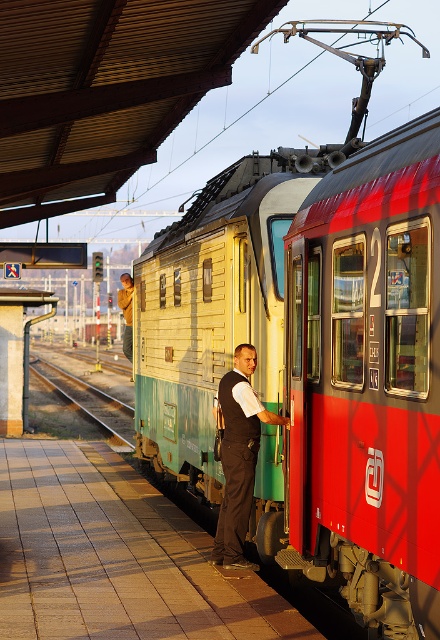
Does point (153, 416) come closer to viewer compared to point (37, 628)?

That is False.

Does metallic yellow-green train at center appear on the right side of brown tile platform at lower left?

Correct, you'll find metallic yellow-green train at center to the right of brown tile platform at lower left.

Identify the location of metallic yellow-green train at center. The image size is (440, 640). (311, 364).

Where is `metallic yellow-green train at center`? This screenshot has height=640, width=440. metallic yellow-green train at center is located at coordinates (311, 364).

Is metallic yellow-green train at center further to camera compared to light brown leather vest at center?

No.

Between metallic yellow-green train at center and light brown leather vest at center, which one has more height?

metallic yellow-green train at center is taller.

Which is in front, point (201, 486) or point (127, 326)?

Point (201, 486)

Image resolution: width=440 pixels, height=640 pixels. I want to click on metallic yellow-green train at center, so click(311, 364).

Is metallic yellow-green train at center further to the viewer compared to black vest at center?

That is False.

Does point (322, 564) lie behind point (222, 532)?

That is False.

Between point (319, 554) and point (223, 528), which one is positioned behind?

The point (223, 528) is more distant.

At what (x,y) coordinates should I click in order to perform the action: click on metallic yellow-green train at center. Please return your answer as a coordinate pair (x, y). Image resolution: width=440 pixels, height=640 pixels. Looking at the image, I should click on (311, 364).